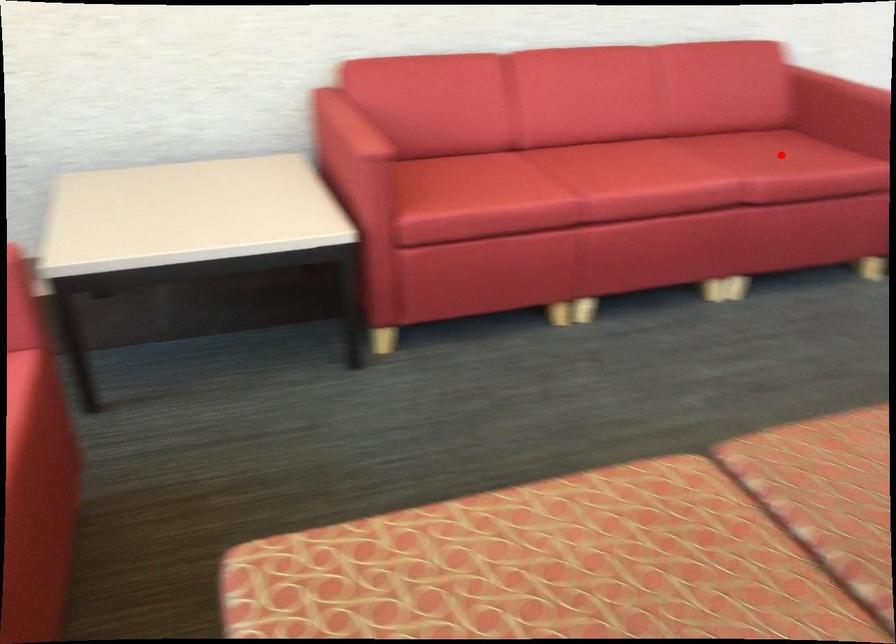
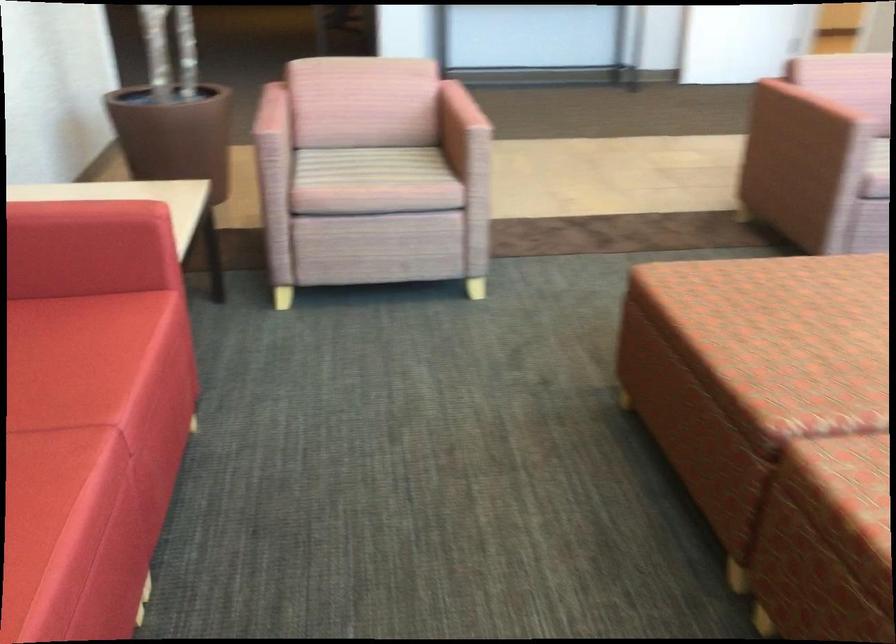
The point at the highlighted location is marked in the first image. Where is the corresponding point in the second image?

(69, 360)